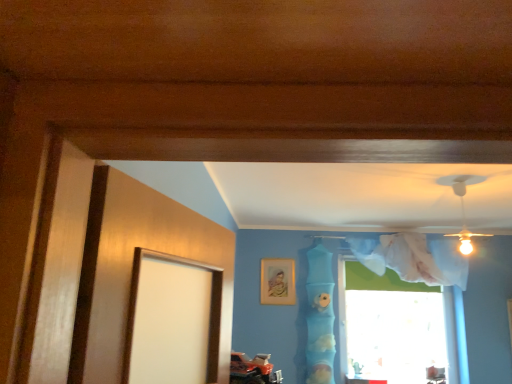
Question: From the image's perspective, is transparent fabric at upper right above blue fabric at center?

Choices:
 (A) yes
 (B) no

Answer: (B)

Question: Does transparent fabric at upper right have a lesser width compared to blue fabric at center?

Choices:
 (A) yes
 (B) no

Answer: (A)

Question: Is transparent fabric at upper right to the left of blue fabric at center from the viewer's perspective?

Choices:
 (A) no
 (B) yes

Answer: (A)

Question: Considering the relative sizes of transparent fabric at upper right and blue fabric at center in the image provided, is transparent fabric at upper right smaller than blue fabric at center?

Choices:
 (A) yes
 (B) no

Answer: (B)

Question: Is transparent fabric at upper right not near blue fabric at center?

Choices:
 (A) yes
 (B) no

Answer: (A)

Question: Considering the positions of transparent fabric at upper right and gold metallic picture frame at upper center in the image, is transparent fabric at upper right taller or shorter than gold metallic picture frame at upper center?

Choices:
 (A) tall
 (B) short

Answer: (A)

Question: Is transparent fabric at upper right inside or outside of gold metallic picture frame at upper center?

Choices:
 (A) outside
 (B) inside

Answer: (A)

Question: In the image, is transparent fabric at upper right positioned in front of or behind gold metallic picture frame at upper center?

Choices:
 (A) front
 (B) behind

Answer: (A)

Question: In terms of size, does transparent fabric at upper right appear bigger or smaller than gold metallic picture frame at upper center?

Choices:
 (A) big
 (B) small

Answer: (A)

Question: In terms of size, does gold metallic picture frame at upper center appear bigger or smaller than transparent fabric at upper right?

Choices:
 (A) big
 (B) small

Answer: (B)

Question: Visually, is gold metallic picture frame at upper center positioned to the left or to the right of transparent fabric at upper right?

Choices:
 (A) left
 (B) right

Answer: (A)

Question: Choose the correct answer: Is gold metallic picture frame at upper center inside transparent fabric at upper right or outside it?

Choices:
 (A) inside
 (B) outside

Answer: (B)

Question: From the image's perspective, relative to transparent fabric at upper right, is gold metallic picture frame at upper center above or below?

Choices:
 (A) below
 (B) above

Answer: (B)

Question: From the image's perspective, is transparent fabric at upper right above or below blue fabric at center?

Choices:
 (A) above
 (B) below

Answer: (B)

Question: From a real-world perspective, is transparent fabric at upper right physically located above or below blue fabric at center?

Choices:
 (A) below
 (B) above

Answer: (A)